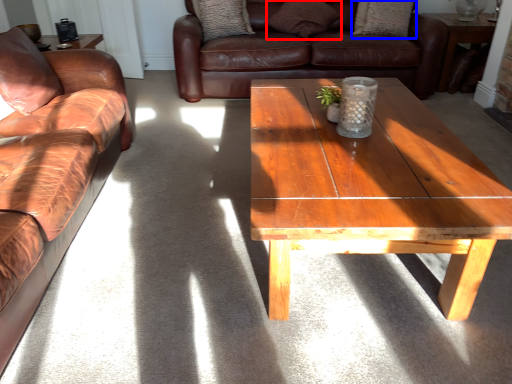
Question: Which object appears farthest to the camera in this image, pillow (highlighted by a red box) or pillow (highlighted by a blue box)?

Choices:
 (A) pillow
 (B) pillow

Answer: (B)